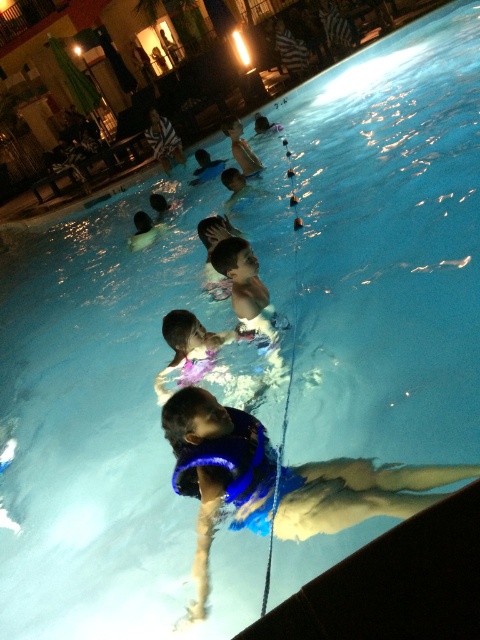
Question: Which point is farther from the camera taking this photo?

Choices:
 (A) (231, 124)
 (B) (324, 516)

Answer: (A)

Question: Can you confirm if blue life vest at center is wider than white plastic cup at upper center?

Choices:
 (A) yes
 (B) no

Answer: (A)

Question: Does blue life vest at center appear on the left side of white plastic cup at upper center?

Choices:
 (A) no
 (B) yes

Answer: (A)

Question: Does blue life vest at center appear on the right side of white plastic cup at upper center?

Choices:
 (A) no
 (B) yes

Answer: (B)

Question: Which point is closer to the camera?

Choices:
 (A) blue life vest at center
 (B) white plastic cup at upper center

Answer: (A)